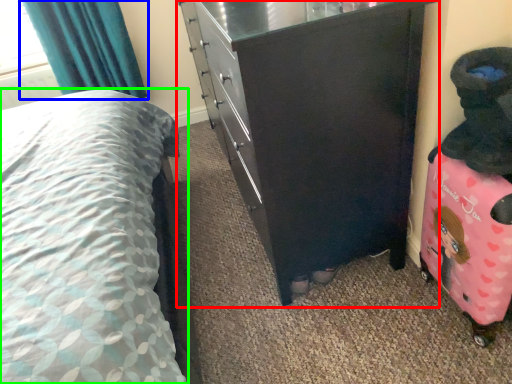
Question: Considering the real-world distances, which object is farthest from chest of drawers (highlighted by a red box)? curtain (highlighted by a blue box) or bed (highlighted by a green box)?

Choices:
 (A) curtain
 (B) bed

Answer: (A)